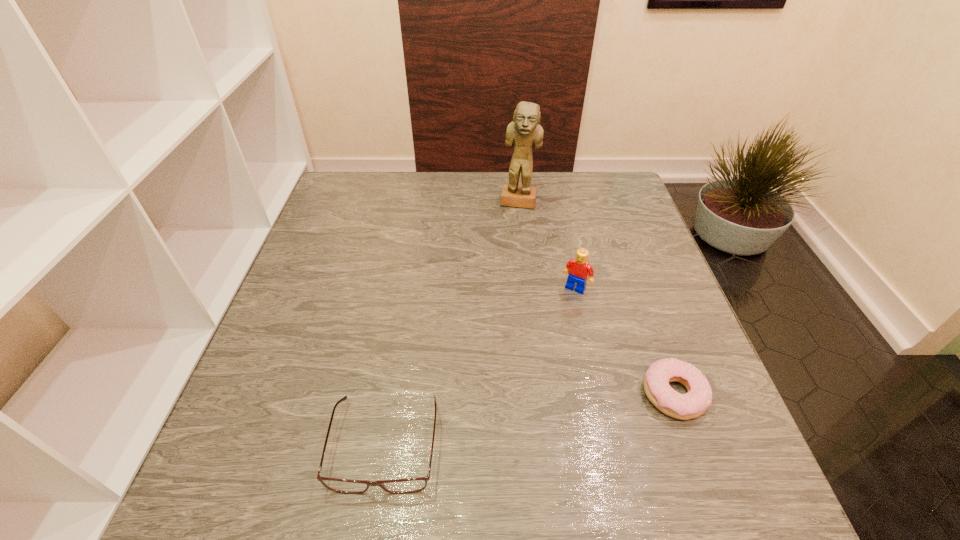
Locate an element on the screen. free space at the left edge is located at coordinates (259, 379).

In the image, there is a desktop. Where is `vacant space at the right edge`? This screenshot has height=540, width=960. vacant space at the right edge is located at coordinates (660, 312).

In the image, there is a desktop. Identify the location of vacant space at the far left corner. (335, 207).

Where is `free space at the far right corner of the desktop`? free space at the far right corner of the desktop is located at coordinates (587, 180).

The height and width of the screenshot is (540, 960). I want to click on vacant space in between the spectacles and the second object from right to left, so click(480, 366).

Locate an element on the screen. empty location between the doughnut and the spectacles is located at coordinates (530, 419).

Find the location of `vacant space in between the leftmost object and the second tallest object`. vacant space in between the leftmost object and the second tallest object is located at coordinates (480, 366).

Where is `empty space that is in between the third object from left to right and the third object from right to left`? Image resolution: width=960 pixels, height=540 pixels. empty space that is in between the third object from left to right and the third object from right to left is located at coordinates (547, 245).

This screenshot has width=960, height=540. In order to click on vacant area between the second object from left to right and the leftmost object in this screenshot , I will do `click(452, 323)`.

I want to click on free space that is in between the second object from left to right and the spectacles, so click(x=452, y=323).